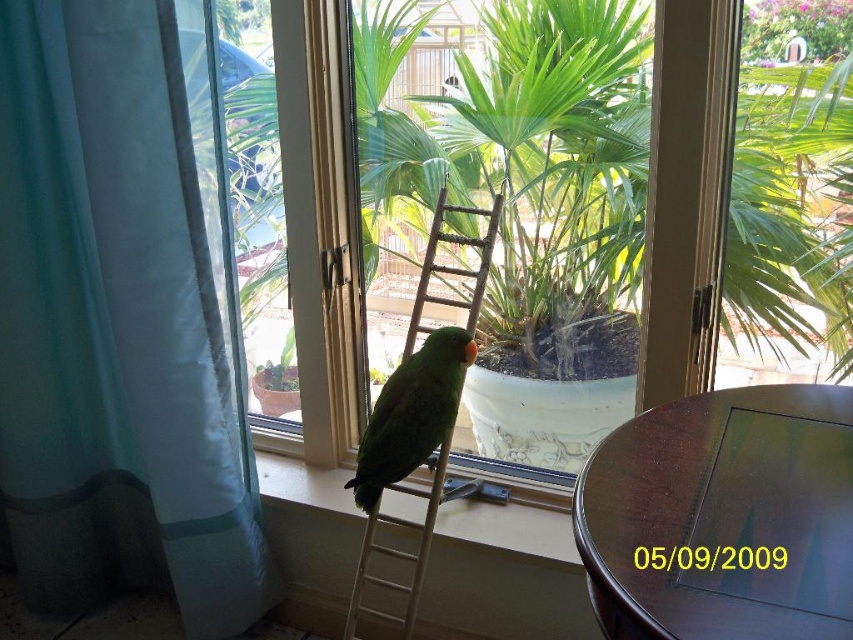
Can you confirm if teal fabric curtain at left is thinner than mahogany wood round table at lower right?

In fact, teal fabric curtain at left might be wider than mahogany wood round table at lower right.

Is teal fabric curtain at left to the right of mahogany wood round table at lower right from the viewer's perspective?

In fact, teal fabric curtain at left is to the left of mahogany wood round table at lower right.

Who is more forward, (32, 326) or (792, 566)?

Point (792, 566) is more forward.

Find the location of `teal fabric curtain at left`. teal fabric curtain at left is located at coordinates (114, 326).

Can you confirm if white smooth window sill at center is positioned above green matte parrot at center?

No, white smooth window sill at center is not above green matte parrot at center.

Can you confirm if white smooth window sill at center is positioned to the left of green matte parrot at center?

Yes, white smooth window sill at center is to the left of green matte parrot at center.

The image size is (853, 640). What are the coordinates of `white smooth window sill at center` in the screenshot? It's located at (509, 529).

Is green leafy plant at center positioned before green matte parrot at center?

Yes, it is in front of green matte parrot at center.

Where is `green leafy plant at center`? green leafy plant at center is located at coordinates (788, 180).

The width and height of the screenshot is (853, 640). I want to click on green leafy plant at center, so click(788, 180).